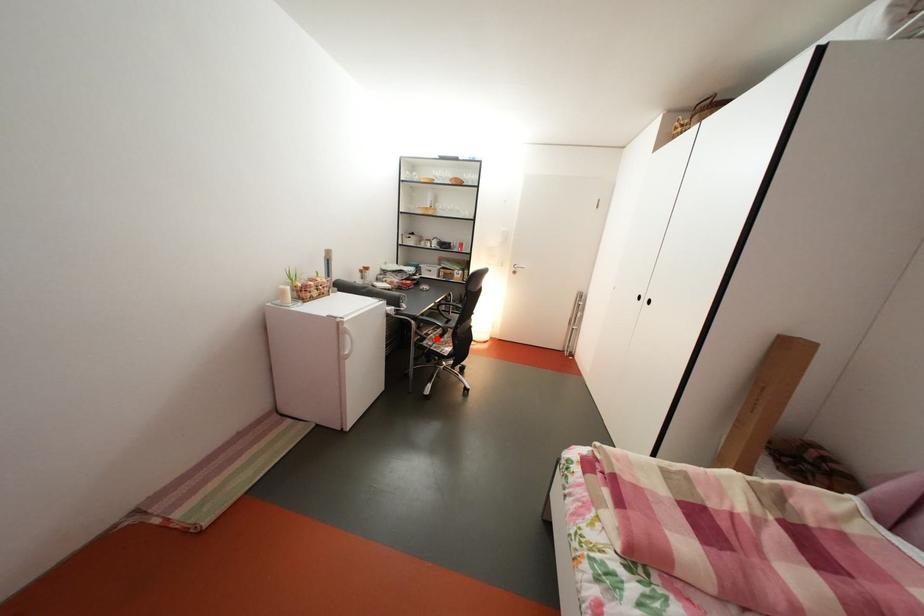
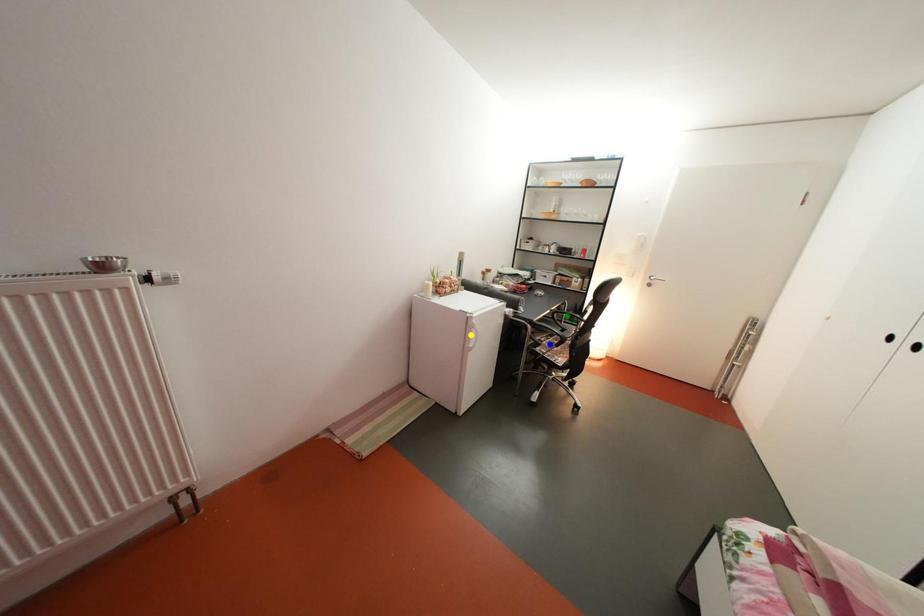
Question: I am providing you with two images of the same scene from different viewpoints. A red point is marked on the first image. You are given multiple points on the second image. Can you choose the point in image 2 that corresponds to the point in image 1?

Choices:
 (A) blue point
 (B) yellow point
 (C) green point

Answer: (A)